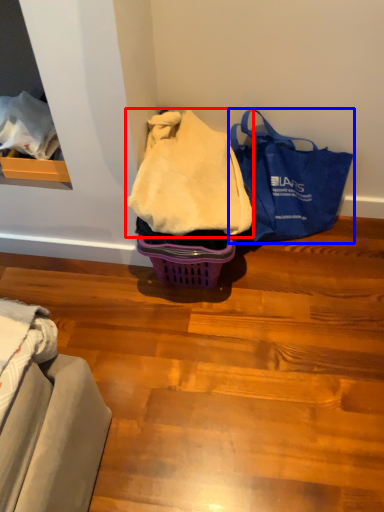
Question: Among these objects, which one is farthest to the camera, blanket (highlighted by a red box) or handbag (highlighted by a blue box)?

Choices:
 (A) blanket
 (B) handbag

Answer: (B)